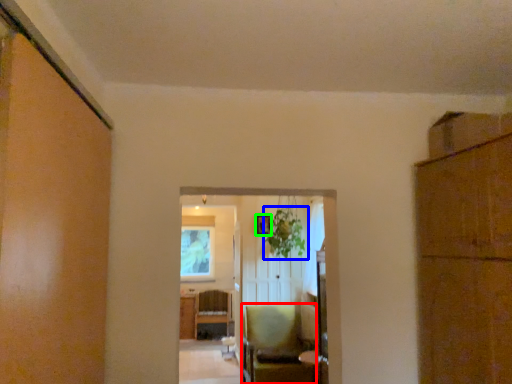
Question: Which is nearer to the chair (highlighted by a red box)? plant (highlighted by a blue box) or picture frame (highlighted by a green box).

Choices:
 (A) plant
 (B) picture frame

Answer: (A)